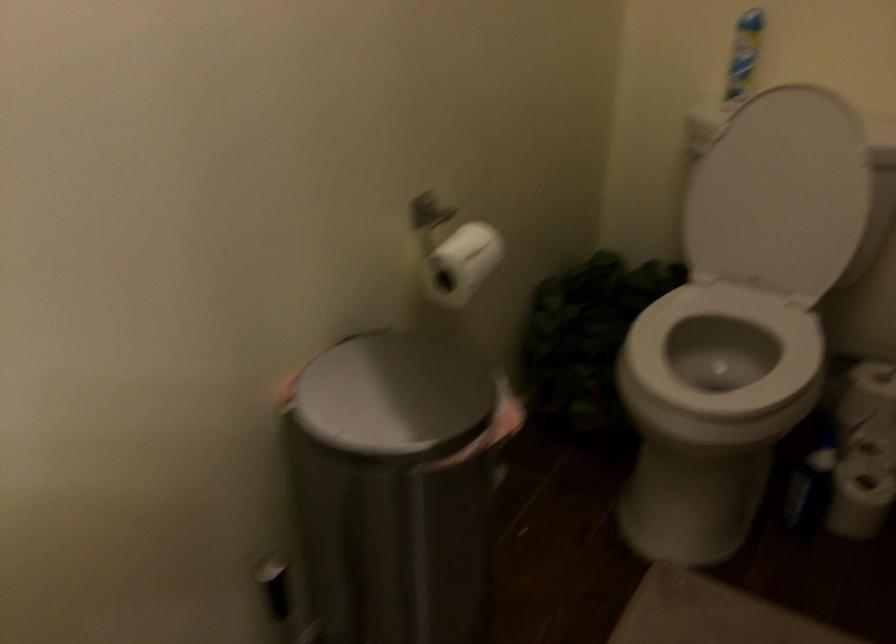
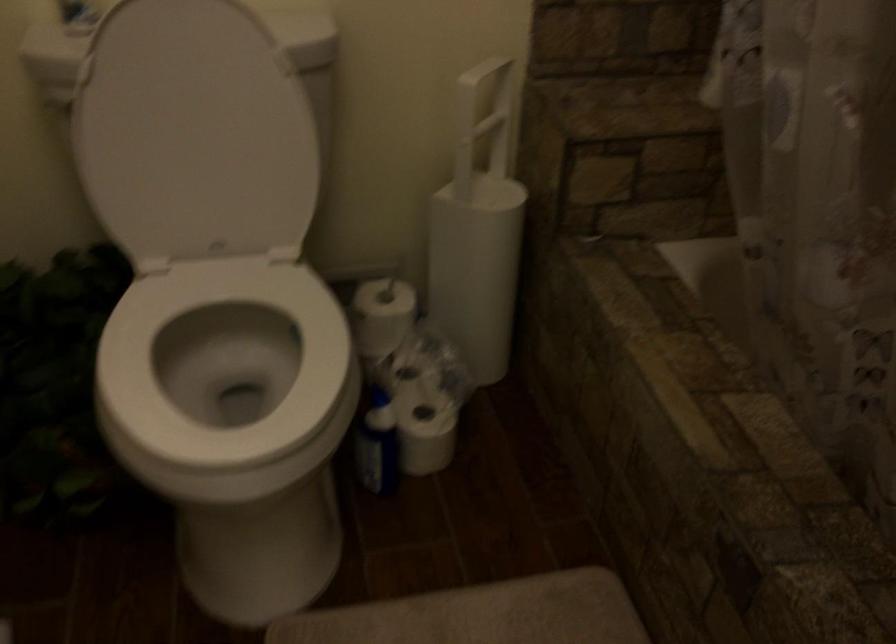
Question: I am providing you with two images of the same scene from different viewpoints. Which of the following objects are not visible in image2?

Choices:
 (A) blue cleaning bottle
 (B) white toilet lid
 (C) toilet paper roll
 (D) none of these

Answer: (D)